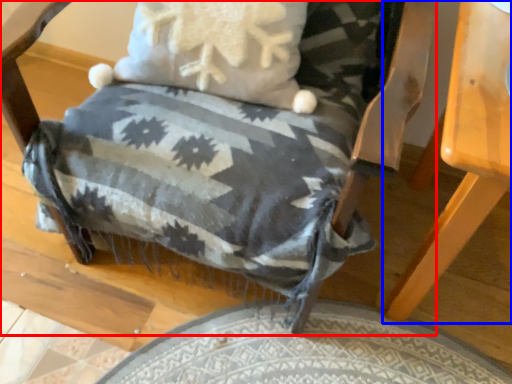
Question: Among these objects, which one is nearest to the camera, chair (highlighted by a red box) or table (highlighted by a blue box)?

Choices:
 (A) chair
 (B) table

Answer: (A)